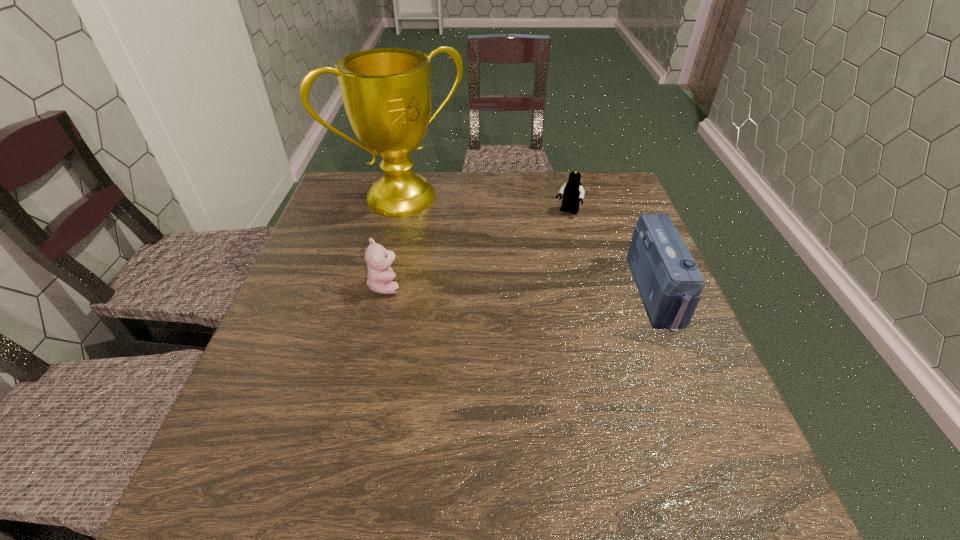
Identify the location of free space between the Lego and the tallest object. This screenshot has height=540, width=960. (486, 205).

Locate an element on the screen. The height and width of the screenshot is (540, 960). vacant space that's between the award and the Lego is located at coordinates (486, 205).

At what (x,y) coordinates should I click in order to perform the action: click on free space between the tallest object and the second object from right to left. Please return your answer as a coordinate pair (x, y). Looking at the image, I should click on (486, 205).

The height and width of the screenshot is (540, 960). What are the coordinates of `free space between the teddy bear and the camera` in the screenshot? It's located at (521, 289).

Where is `free space between the rightmost object and the second object from right to left`? The width and height of the screenshot is (960, 540). free space between the rightmost object and the second object from right to left is located at coordinates (612, 253).

Find the location of `the third closest object to the award`. the third closest object to the award is located at coordinates (669, 282).

Point out which object is positioned as the third nearest to the second object from right to left. Please provide its 2D coordinates. Your answer should be formatted as a tuple, i.e. [(x, y)], where the tuple contains the x and y coordinates of a point satisfying the conditions above.

[(378, 259)]

Identify the location of blank area in the image that satisfies the following two spatial constraints: 1. on the front side of the award; 2. on the lens of the rightmost object. The width and height of the screenshot is (960, 540). (381, 293).

What are the coordinates of `free space that satisfies the following two spatial constraints: 1. on the front side of the second object from right to left; 2. on the lens of the rightmost object` in the screenshot? It's located at click(588, 293).

Where is `free space in the image that satisfies the following two spatial constraints: 1. on the front side of the tallest object; 2. on the left side of the second object from right to left`? free space in the image that satisfies the following two spatial constraints: 1. on the front side of the tallest object; 2. on the left side of the second object from right to left is located at coordinates (400, 213).